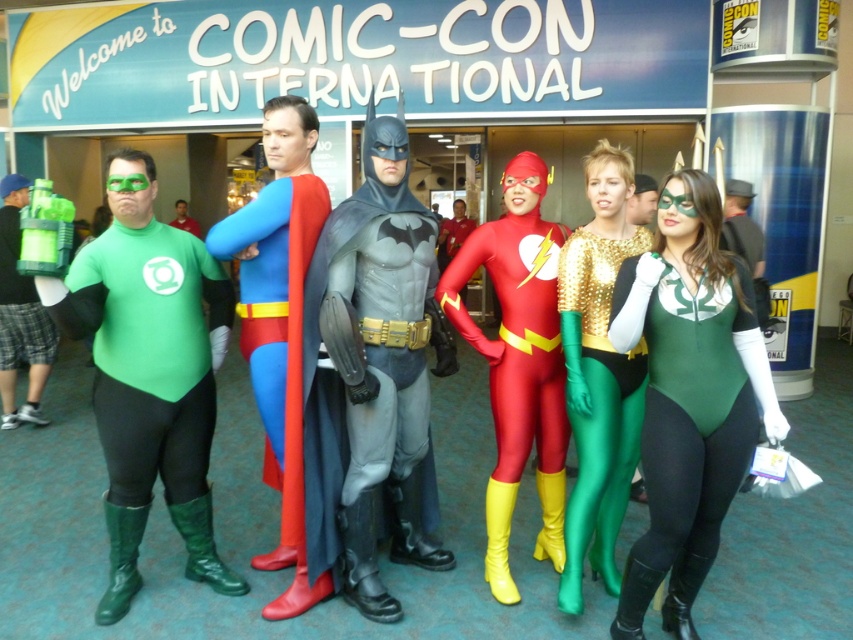
You are a photographer at Comic Con International. You want to take a photo of the green spandex bodysuit at center and the matte green backpack at left. Which object should be placed closer to the camera to ensure both are in focus without adjusting the camera settings?

The green spandex bodysuit at center is wider than the matte green backpack at left. To ensure both are in focus without adjusting the camera settings, place the wider object, the green spandex bodysuit at center, closer to the camera. This technique helps maintain depth of field and sharpness across both subjects.